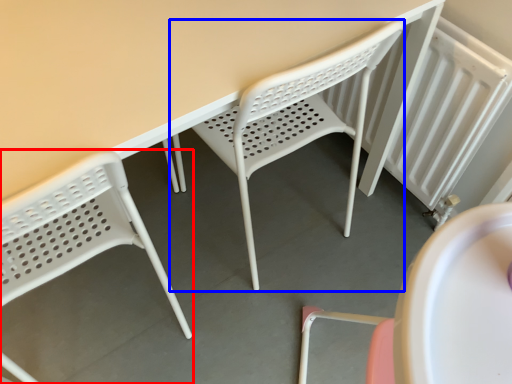
Question: Which object is further to the camera taking this photo, chair (highlighted by a red box) or chair (highlighted by a blue box)?

Choices:
 (A) chair
 (B) chair

Answer: (B)